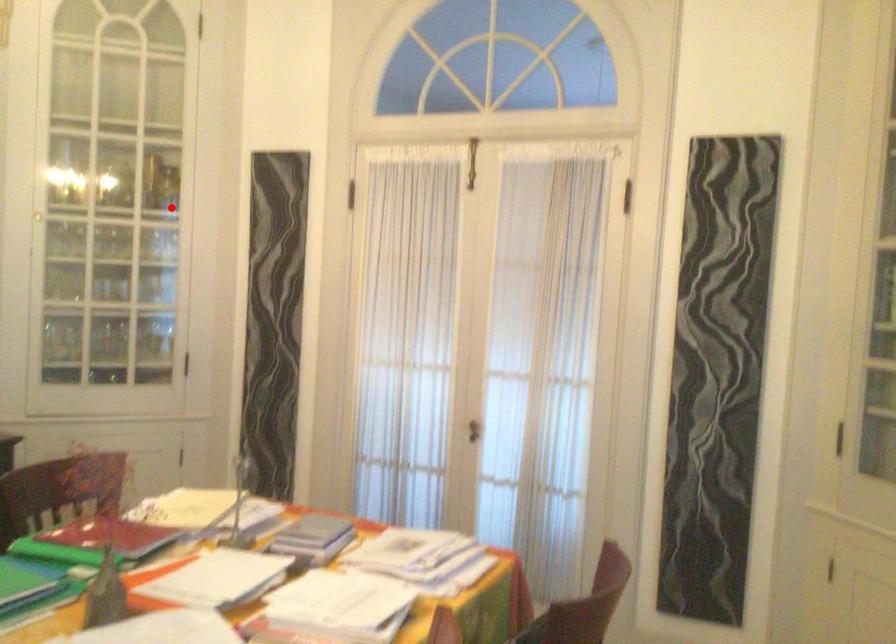
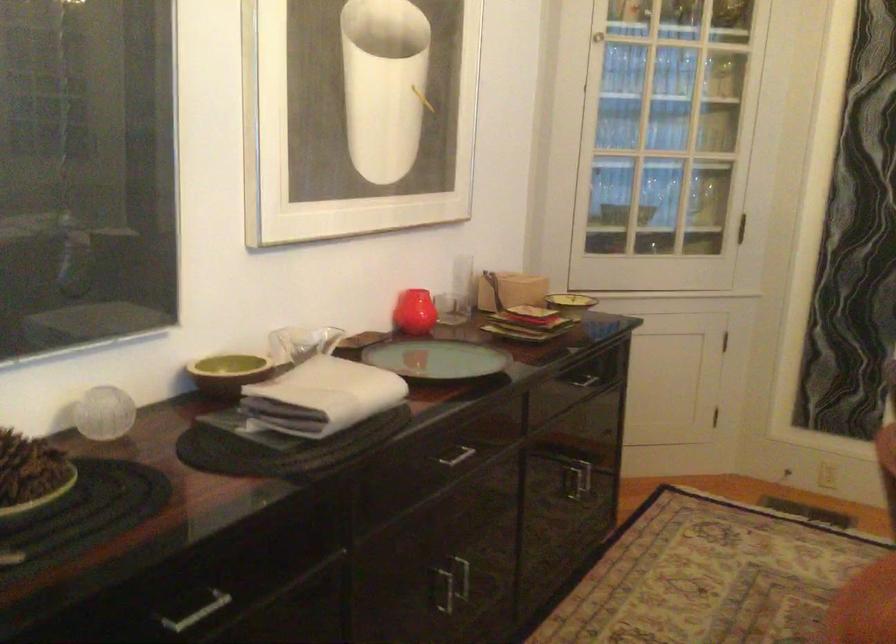
Question: I am providing you with two images of the same scene from different viewpoints. A red point is shown in image1. For the corresponding object point in image2, is it positioned nearer or farther from the camera?

Choices:
 (A) Nearer
 (B) Farther

Answer: (A)